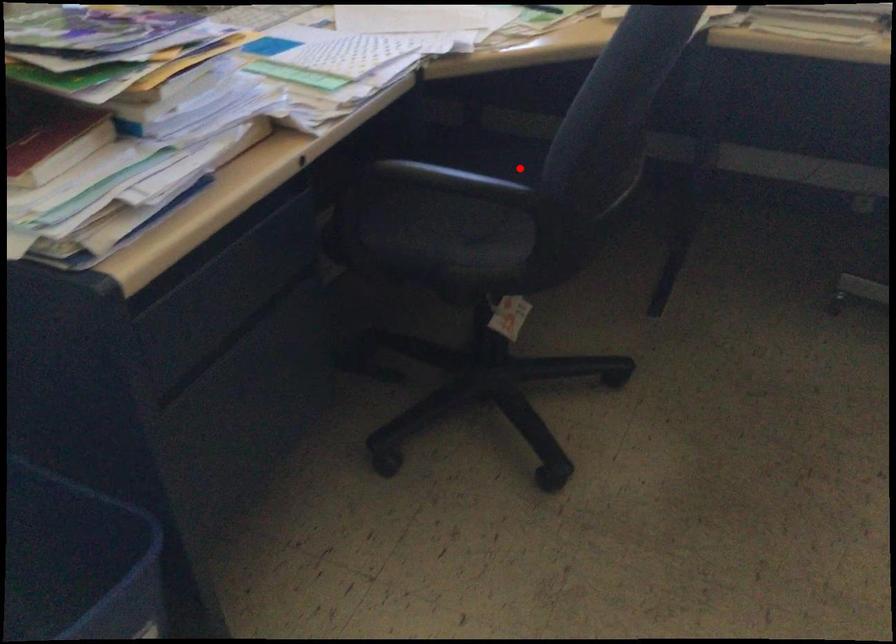
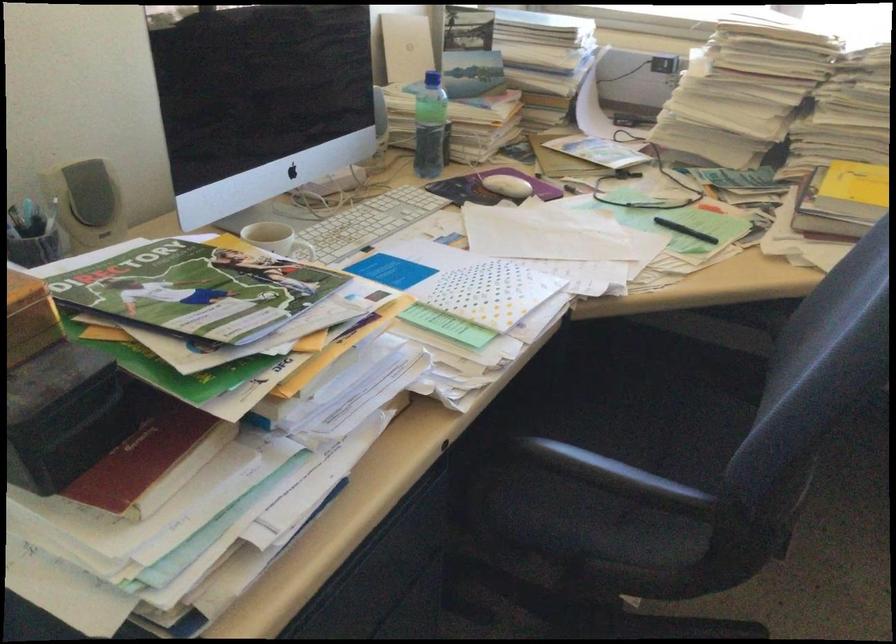
The point at the highlighted location is marked in the first image. Where is the corresponding point in the second image?

(653, 411)